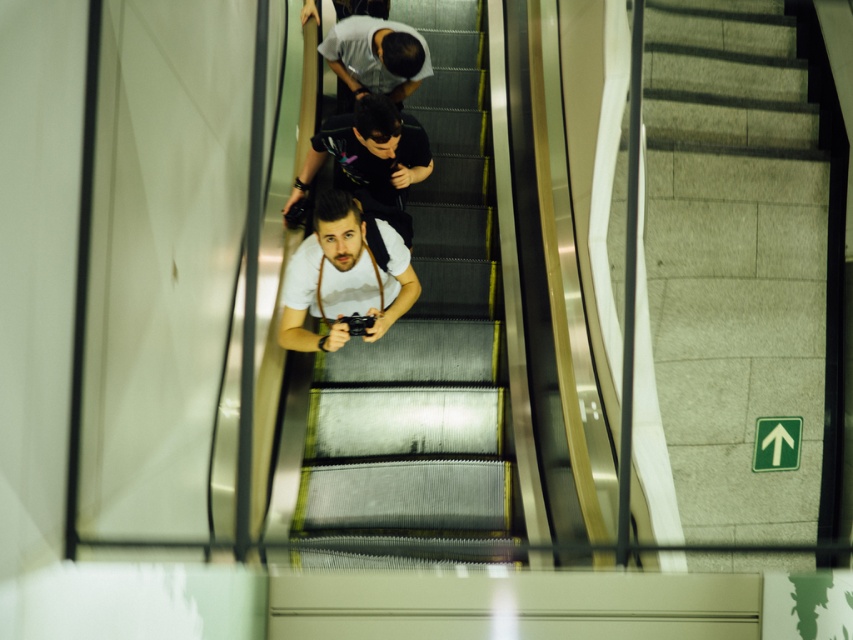
Question: Among these objects, which one is farthest from the camera?

Choices:
 (A) matte black shirt at upper center
 (B) white matte shirt at center

Answer: (A)

Question: Is white matte shirt at center to the left of matte black shirt at upper center from the viewer's perspective?

Choices:
 (A) no
 (B) yes

Answer: (B)

Question: Can you confirm if white matte shirt at center is smaller than matte black camera at center?

Choices:
 (A) no
 (B) yes

Answer: (B)

Question: Where is metallic escalator steps at center located in relation to matte black camera at center in the image?

Choices:
 (A) above
 (B) below

Answer: (B)

Question: Which object is positioned farthest from the matte black camera at center?

Choices:
 (A) white matte shirt at center
 (B) matte black shirt at upper center
 (C) metallic escalator steps at center

Answer: (A)

Question: Estimate the real-world distances between objects in this image. Which object is farther from the metallic escalator steps at center?

Choices:
 (A) matte black camera at center
 (B) matte black shirt at upper center

Answer: (B)